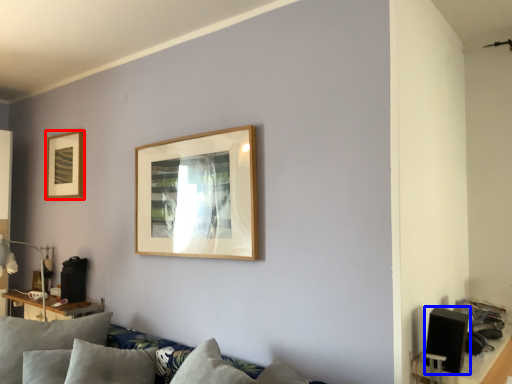
Question: Which object appears farthest to the camera in this image, picture frame (highlighted by a red box) or speaker (highlighted by a blue box)?

Choices:
 (A) picture frame
 (B) speaker

Answer: (A)